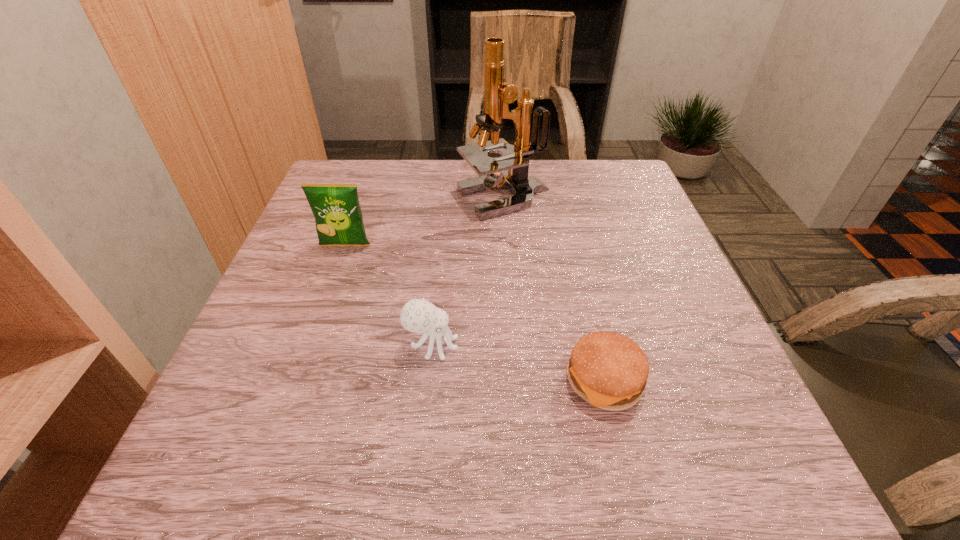
Identify the location of free spot located 0.380m on the front-facing side of the octopus. The image size is (960, 540). (672, 345).

Where is `free space located on the back of the hamburger`? The width and height of the screenshot is (960, 540). free space located on the back of the hamburger is located at coordinates (577, 264).

Identify the location of object situated at the far edge. (499, 94).

Where is `object that is positioned at the left edge`? object that is positioned at the left edge is located at coordinates (338, 217).

Where is `object that is at the right edge`? Image resolution: width=960 pixels, height=540 pixels. object that is at the right edge is located at coordinates (608, 370).

I want to click on vacant space at the far edge of the desktop, so click(x=566, y=187).

Locate an element on the screen. free region at the near edge of the desktop is located at coordinates (343, 468).

The width and height of the screenshot is (960, 540). In the image, there is a desktop. Identify the location of vacant space at the left edge. 251,356.

In the image, there is a desktop. Identify the location of vacant space at the right edge. This screenshot has height=540, width=960. (632, 265).

The height and width of the screenshot is (540, 960). In the image, there is a desktop. Find the location of `vacant space at the far right corner`. vacant space at the far right corner is located at coordinates (624, 199).